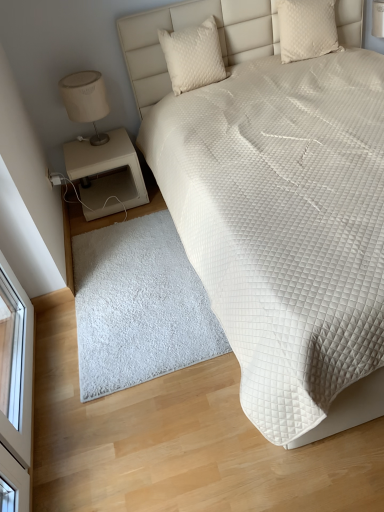
Identify the location of vacant area on top of matte beige lampshade at left (from a real-world perspective). (81, 73).